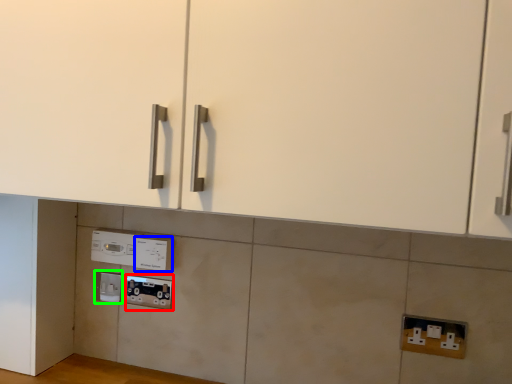
Question: Which object is positioned closest to socket (highlighted by a red box)? Select from electric outlet (highlighted by a blue box) and electric outlet (highlighted by a green box).

Choices:
 (A) electric outlet
 (B) electric outlet

Answer: (A)